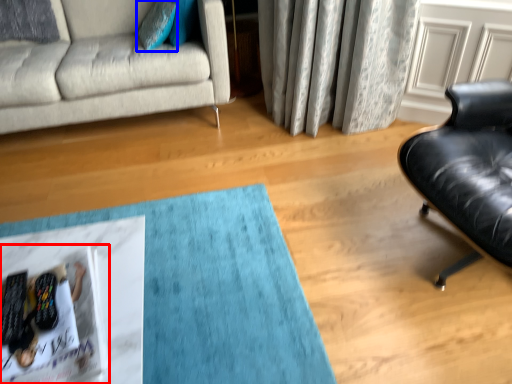
Question: Which of the following is the closest to the observer, magazine (highlighted by a red box) or pillow (highlighted by a blue box)?

Choices:
 (A) magazine
 (B) pillow

Answer: (A)